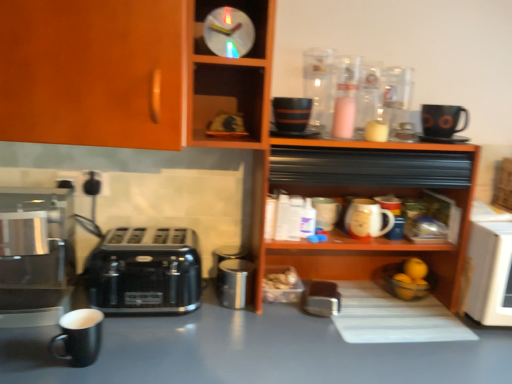
Where is `vacant space situated on the left part of black matte mug at lower left`? vacant space situated on the left part of black matte mug at lower left is located at coordinates (29, 352).